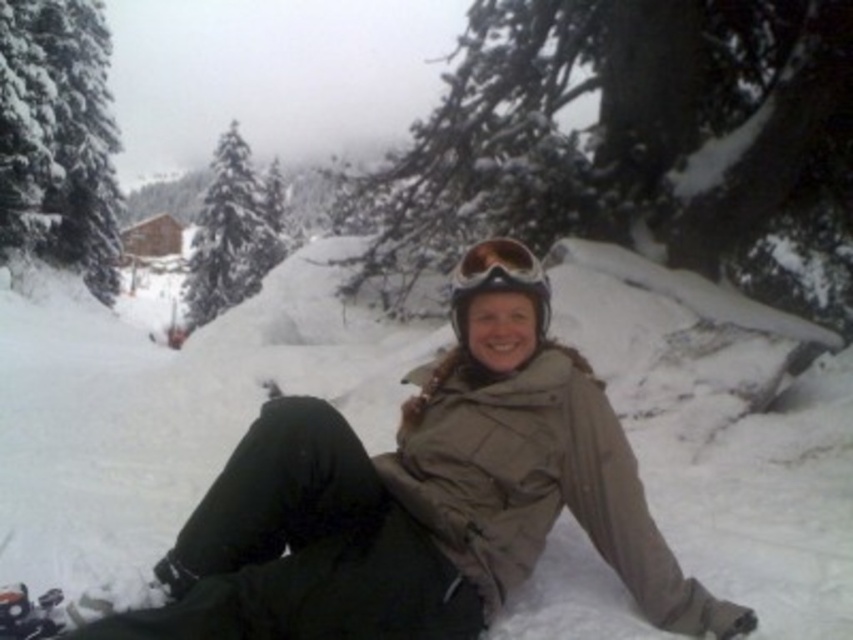
Based on the photo, you are a photographer trying to capture the perfect shot of the white fluffy snow at center and the matte black goggles at center. If you want to frame both objects in your camera, which object will require a wider angle to fully capture?

The white fluffy snow at center requires a wider angle because its width surpasses that of the matte black goggles at center.

You are a photographer trying to capture a photo of the green matte pine at upper left and the matte black goggles at center. Which object is taller in the image?

The green matte pine at upper left is much taller than the matte black goggles at center, so the green matte pine at upper left will appear taller in the photo.

You are a photographer trying to capture the green matte pine at upper left and the matte black goggles at center in the same frame. Based on their positions, can you tell me if the pine is positioned higher or lower than the goggles?

The green matte pine at upper left is above the matte black goggles at center, so it is positioned higher than the goggles.